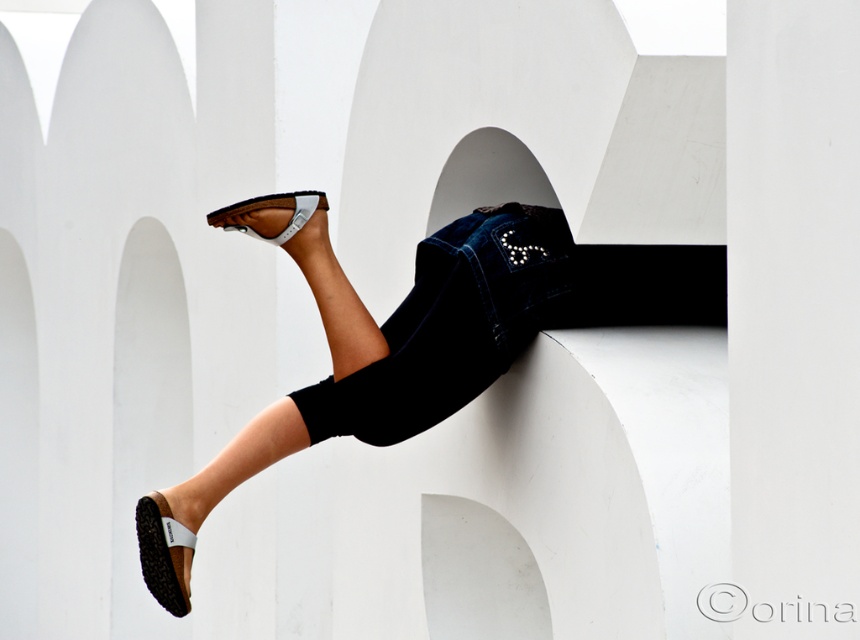
You are trying to decide whether to place a small plant between the denim jacket at center and the black rubber sandal at lower left. Based on their widths, will there be enough space for the plant?

The denim jacket at center might be wider than black rubber sandal at lower left, so there may not be enough space for the plant between them.

Looking at this image, you are a shoe designer trying to create a pair of sandals that will fit comfortably between the brown leather sandals at lower left and the black rubber sandal at lower left. Based on their widths, which existing sandal should you use as a reference for the minimum width?

The black rubber sandal at lower left has a smaller width than the brown leather sandals at lower left. Therefore, you should use the black rubber sandal at lower left as the reference for the minimum width to ensure the new design fits comfortably between them.

Based on the photo, you are standing in front of the white wall with geometric cutouts and notice a denim jacket at center. Where exactly is the denim jacket positioned relative to the cutouts?

The denim jacket at center is located at point (453, 324), which places it centrally within the scene, likely between or in front of the geometric cutouts on the wall.